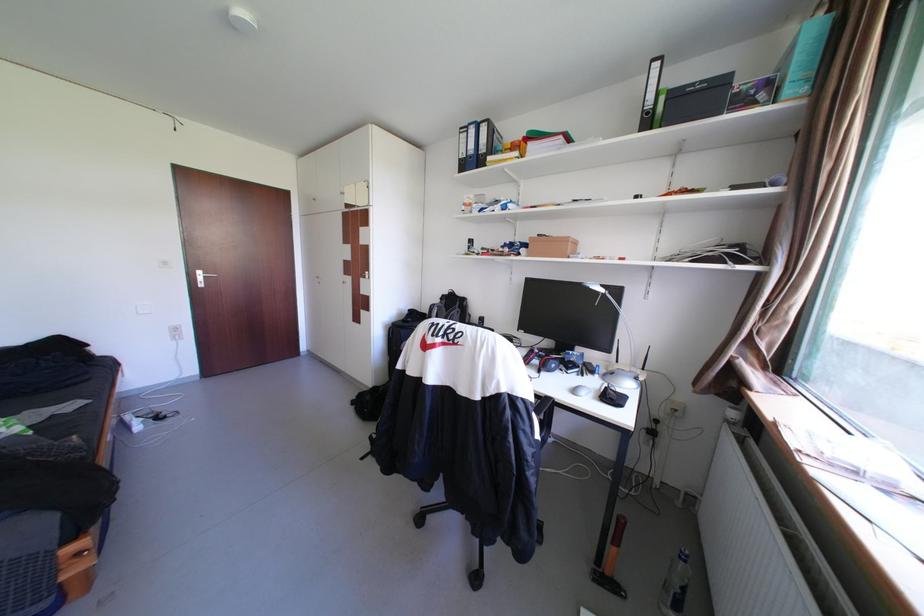
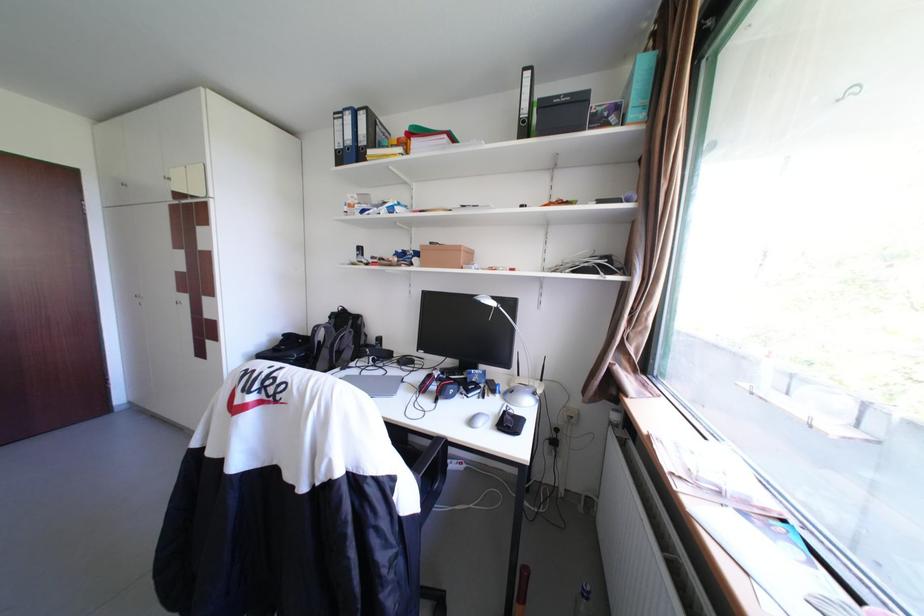
Find the pixel in the second image that matches pixel 455 302 in the first image.

(344, 321)